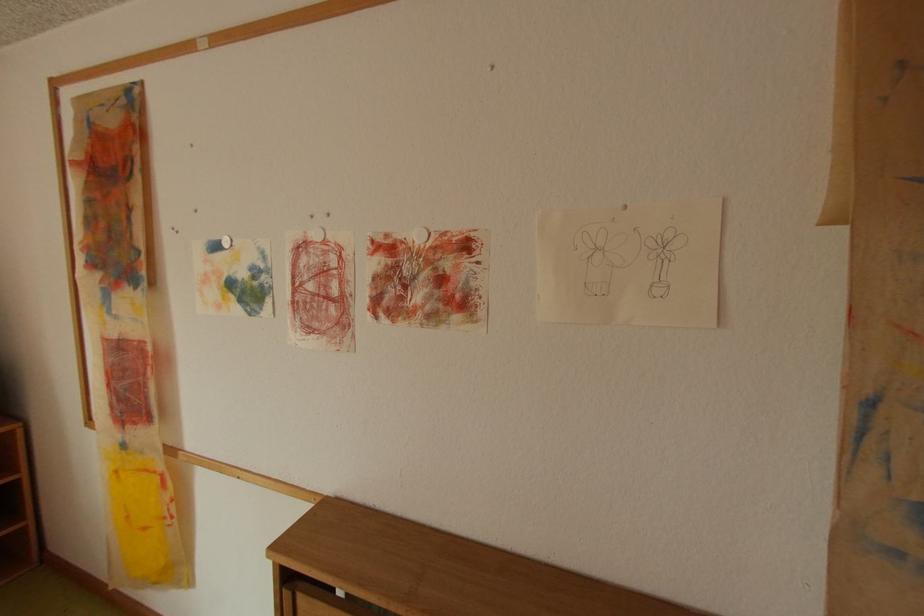
Where is `long paper painting`? The height and width of the screenshot is (616, 924). long paper painting is located at coordinates (122, 338).